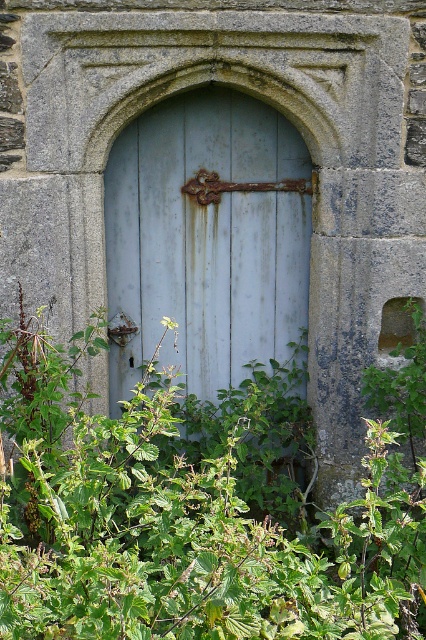
You are standing in front of an old weathered door with a stone archway. You notice a green leafy plant at center. Based on its position, can you determine if the plant is closer to the door or the archway?

The green leafy plant at center is located at point coordinates that place it closer to the door than the archway.